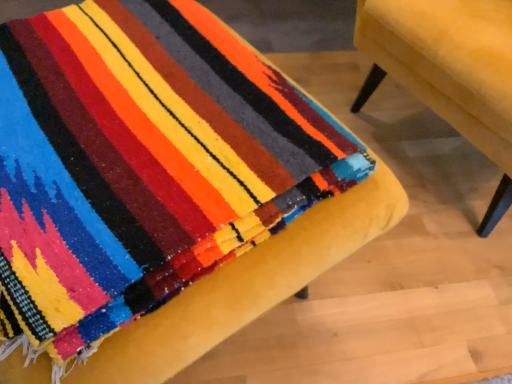
In order to face velvet yellow ottoman at right, should I rotate leftwards or rightwards?

Turn right by 33.896 degrees to look at velvet yellow ottoman at right.

This screenshot has width=512, height=384. I want to click on velvet yellow ottoman at right, so click(449, 70).

What do you see at coordinates (449, 70) in the screenshot? I see `velvet yellow ottoman at right` at bounding box center [449, 70].

Where is `velvet yellow ottoman at right`? The width and height of the screenshot is (512, 384). velvet yellow ottoman at right is located at coordinates (449, 70).